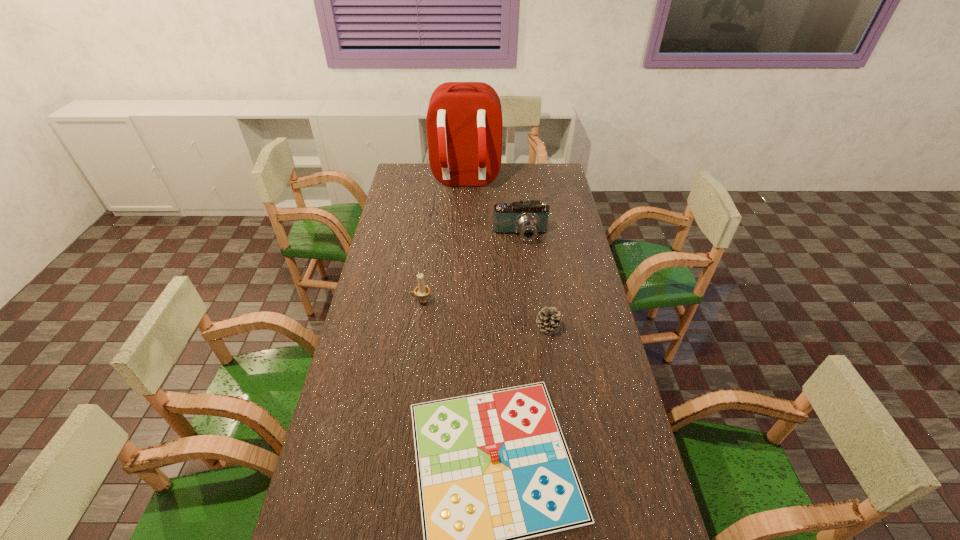
Find the location of a particular element. The image size is (960, 540). vacant space located 0.100m on the handle side of the third farthest object is located at coordinates (384, 301).

The width and height of the screenshot is (960, 540). What are the coordinates of `vacant area situated on the right of the second nearest object` in the screenshot? It's located at (604, 327).

Find the location of `object that is at the far edge`. object that is at the far edge is located at coordinates (464, 125).

Locate an element on the screen. camcorder located in the right edge section of the desktop is located at coordinates (530, 218).

Identify the location of pinecone that is at the right edge. This screenshot has width=960, height=540. (549, 319).

Find the location of a particular element. Image resolution: width=960 pixels, height=540 pixels. free space at the far edge of the desktop is located at coordinates (504, 173).

This screenshot has height=540, width=960. In the image, there is a desktop. In order to click on blank space at the left edge in this screenshot , I will do (375, 360).

Where is `free space at the right edge of the desktop`? free space at the right edge of the desktop is located at coordinates (609, 346).

You are a GUI agent. You are given a task and a screenshot of the screen. Output one action in this format:
    pyautogui.click(x=<x>, y=<y>)
    Task: Click on the free space at the far left corner of the desktop
    This screenshot has height=540, width=960.
    Given the screenshot: What is the action you would take?
    pyautogui.click(x=398, y=172)

The width and height of the screenshot is (960, 540). In the image, there is a desktop. Find the location of `free space at the far right corner`. free space at the far right corner is located at coordinates (545, 181).